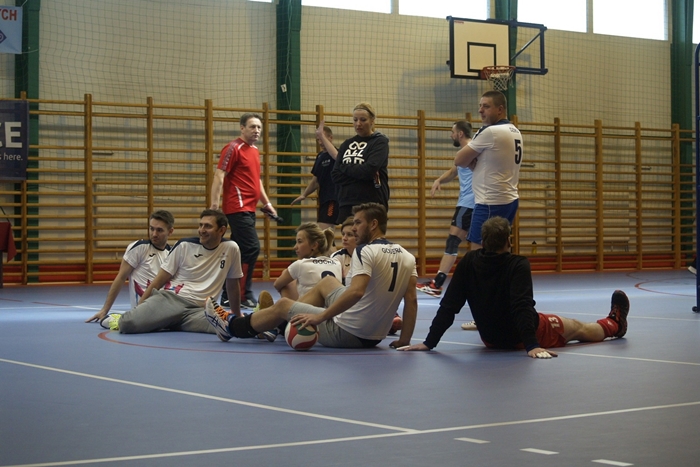
Locate an element on the screen. This screenshot has width=700, height=467. windows is located at coordinates (621, 19), (561, 20), (425, 11), (372, 5).